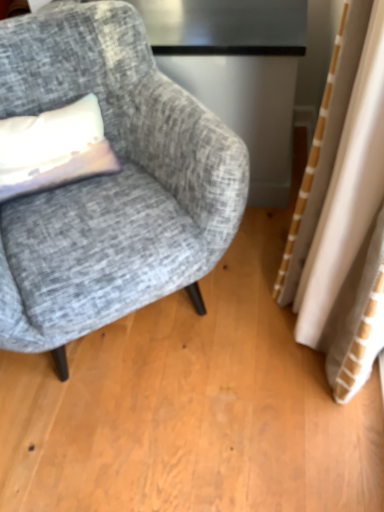
Question: Should I look upward or downward to see matte white pillow at left?

Choices:
 (A) down
 (B) up

Answer: (B)

Question: Is textured gray fabric chair at left behind matte white pillow at left?

Choices:
 (A) no
 (B) yes

Answer: (A)

Question: Does textured gray fabric chair at left have a larger size compared to matte white pillow at left?

Choices:
 (A) no
 (B) yes

Answer: (B)

Question: Does textured gray fabric chair at left have a greater width compared to matte white pillow at left?

Choices:
 (A) no
 (B) yes

Answer: (B)

Question: Can you confirm if textured gray fabric chair at left is smaller than matte white pillow at left?

Choices:
 (A) yes
 (B) no

Answer: (B)

Question: From the image's perspective, is textured gray fabric chair at left over matte white pillow at left?

Choices:
 (A) no
 (B) yes

Answer: (A)

Question: Is textured gray fabric chair at left at the left side of matte white pillow at left?

Choices:
 (A) yes
 (B) no

Answer: (B)

Question: Is matte white pillow at left placed right next to textured gray fabric chair at left?

Choices:
 (A) no
 (B) yes

Answer: (A)

Question: Is matte white pillow at left shorter than textured gray fabric chair at left?

Choices:
 (A) no
 (B) yes

Answer: (B)

Question: Is matte white pillow at left to the right of textured gray fabric chair at left from the viewer's perspective?

Choices:
 (A) yes
 (B) no

Answer: (B)

Question: Considering the relative sizes of matte white pillow at left and textured gray fabric chair at left in the image provided, is matte white pillow at left smaller than textured gray fabric chair at left?

Choices:
 (A) yes
 (B) no

Answer: (A)

Question: Does matte white pillow at left have a larger size compared to textured gray fabric chair at left?

Choices:
 (A) yes
 (B) no

Answer: (B)

Question: Can you confirm if matte white pillow at left is taller than textured gray fabric chair at left?

Choices:
 (A) no
 (B) yes

Answer: (A)

Question: From the image's perspective, is matte white pillow at left located above or below textured gray fabric chair at left?

Choices:
 (A) above
 (B) below

Answer: (A)